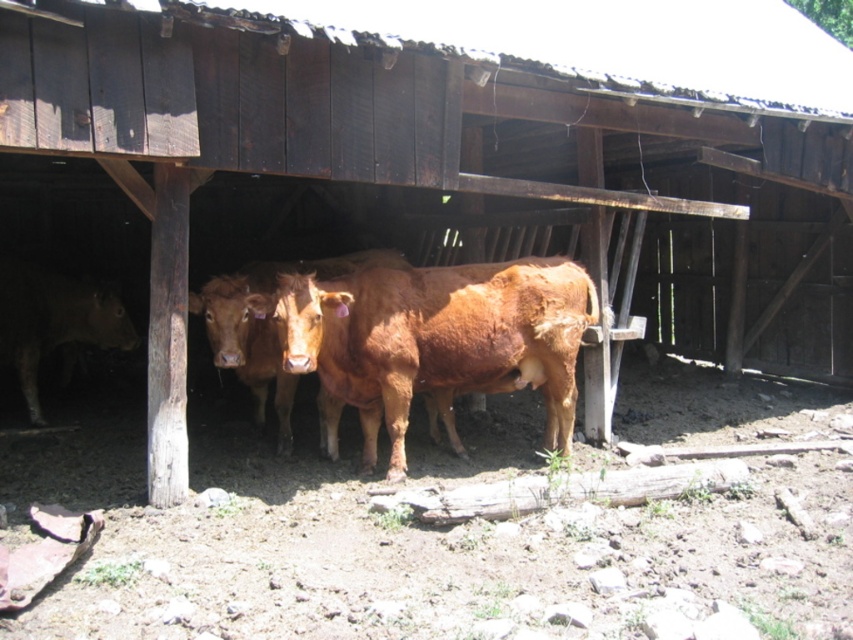
You are a farmer who needs to separate two cows for feeding. You have a divider that is 2.5 meters long. If you place it between the brown rough cow at center and the brown smooth cow at left, will it be long enough to separate them?

The distance between the brown rough cow at center and the brown smooth cow at left is 2.79 meters. Since the divider is only 2.5 meters long, it will not be long enough to fully separate them as the required distance exceeds the divider length.

You are standing 10 feet away from the brown rough cow at center. If you want to take a photo of it without getting too close, can you stay where you are?

The brown rough cow at center is 15.25 feet from the camera. Since you are standing 10 feet away from it, you are actually closer than the camera position. To take the photo without getting closer, you can stay at your current position as you are already within the 15.25 feet distance.

You are a farmer checking the cows in your barn. You notice two cows, the brown rough cow at center and the brown smooth cow at left. Which cow requires more feed based on their size?

The brown rough cow at center requires more feed because it is larger in size than the brown smooth cow at left.